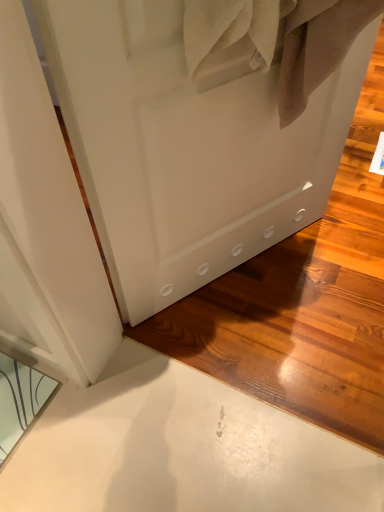
Image resolution: width=384 pixels, height=512 pixels. Find the location of `unoccupied area in front of white matte door at center`. unoccupied area in front of white matte door at center is located at coordinates click(x=260, y=359).